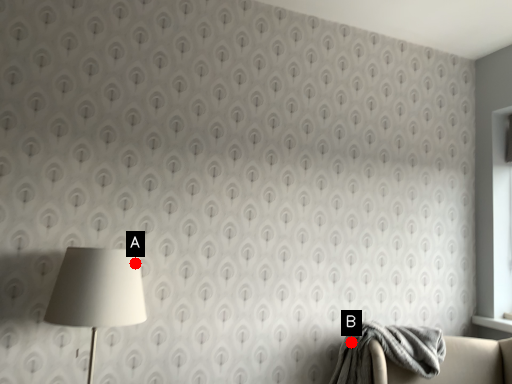
Question: Two points are circled on the image, labeled by A and B beside each circle. Which point appears farthest from the camera in this image?

Choices:
 (A) A is further
 (B) B is further

Answer: (B)